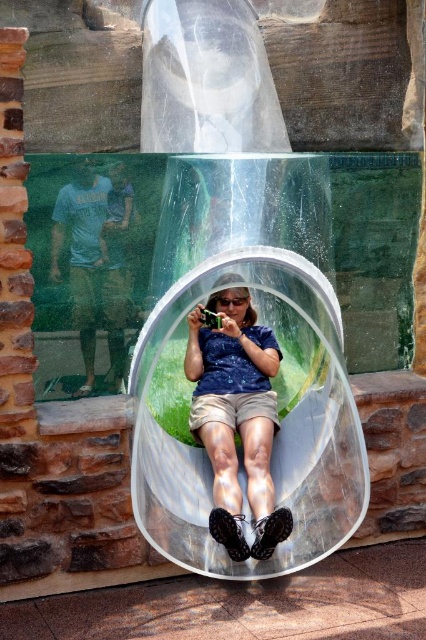
Question: Which point is farther from the camera taking this photo?

Choices:
 (A) (327, 413)
 (B) (239, 356)

Answer: (B)

Question: Is the position of matte blue shirt at center less distant than that of light blue t-shirt at left?

Choices:
 (A) no
 (B) yes

Answer: (B)

Question: Based on their relative distances, which object is farther from the light blue t-shirt at left?

Choices:
 (A) transparent plastic bubble at center
 (B) matte blue shirt at center

Answer: (A)

Question: Can you confirm if matte blue shirt at center is positioned to the left of light blue t-shirt at left?

Choices:
 (A) yes
 (B) no

Answer: (B)

Question: Estimate the real-world distances between objects in this image. Which object is farther from the matte blue shirt at center?

Choices:
 (A) light blue t-shirt at left
 (B) transparent plastic bubble at center

Answer: (A)

Question: Does transparent plastic bubble at center appear on the left side of matte blue shirt at center?

Choices:
 (A) no
 (B) yes

Answer: (A)